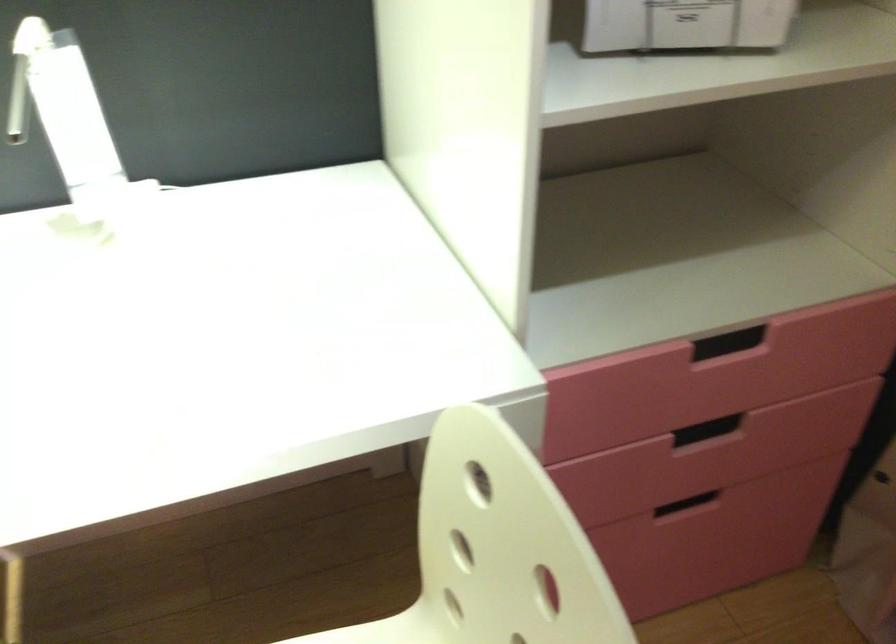
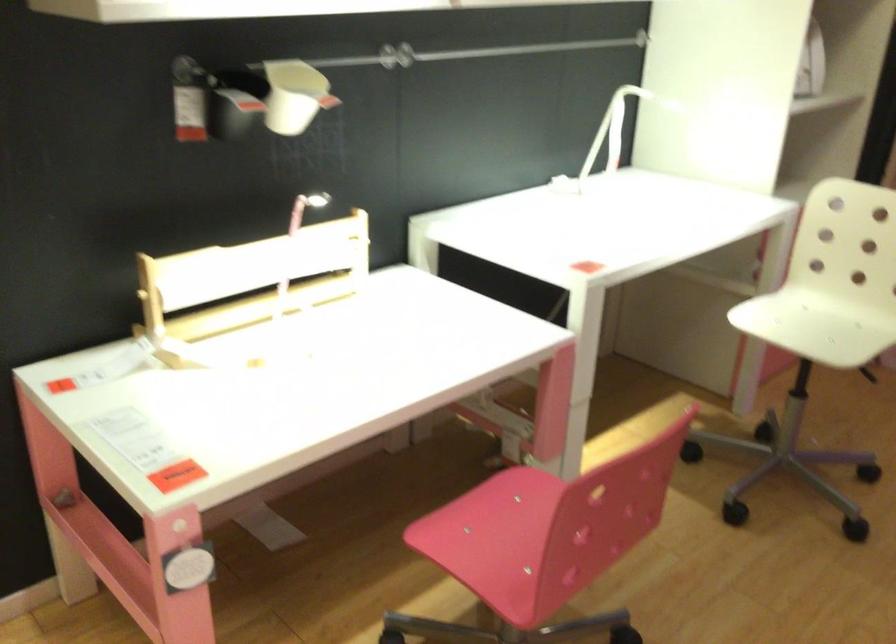
Question: I am providing you with two images of the same scene from different viewpoints. Please identify which objects are invisible in image2.

Choices:
 (A) black wall container
 (B) white wall cup
 (C) pink chair sitting surface
 (D) none of these

Answer: (D)